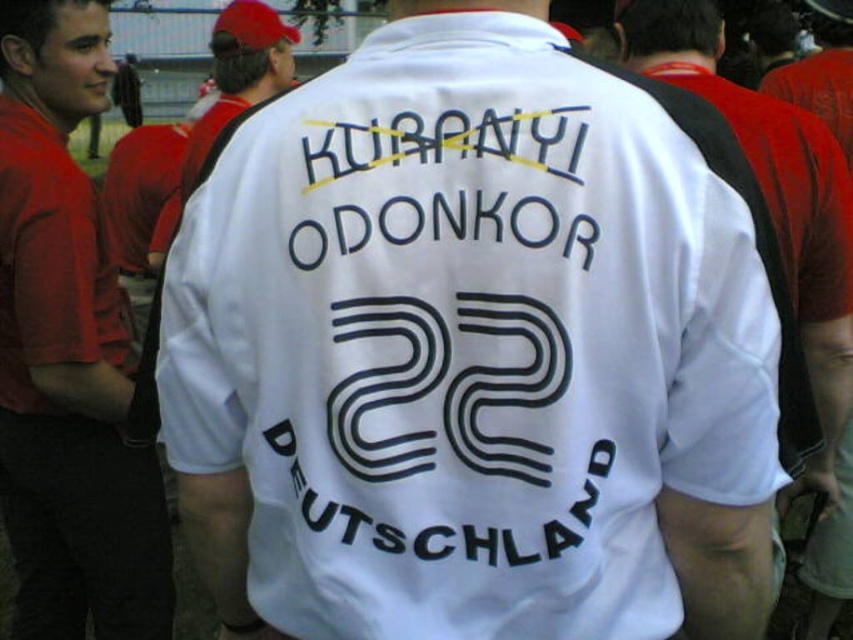
Question: Which of these objects is positioned farthest from the black printed text at center?

Choices:
 (A) white jersey at center
 (B) matte red shirt at left

Answer: (B)

Question: Is black printed text at center below white jersey at center?

Choices:
 (A) no
 (B) yes

Answer: (B)

Question: Does black printed text at center appear under black text at center?

Choices:
 (A) no
 (B) yes

Answer: (B)

Question: Estimate the real-world distances between objects in this image. Which object is closer to the white jersey at center?

Choices:
 (A) matte red shirt at left
 (B) black printed text at center
 (C) black text at center

Answer: (B)

Question: Can you confirm if black printed text at center is positioned below white jersey at center?

Choices:
 (A) yes
 (B) no

Answer: (A)

Question: Which point appears closest to the camera in this image?

Choices:
 (A) (120, 300)
 (B) (651, 68)
 (C) (517, 202)

Answer: (C)